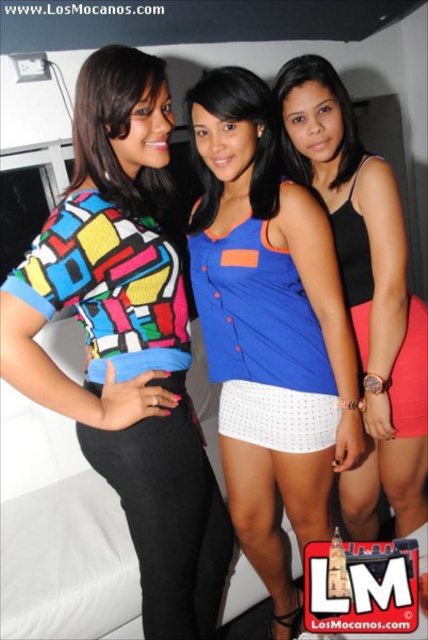
Consider the image. You are at a social gathering and want to take a photo of the two points mentioned. The points are labeled as point (366, 465) and point (103, 147). Which point should you focus on first to ensure both are in the frame?

You should focus on point (103, 147) first because it is in front of point (366, 465), so capturing it first ensures both points remain visible in the frame.

Consider the image. You are a photographer adjusting your camera settings to capture the three women in the scene. You notice two blue tops, the blue fabric top at center and the blue fabric blouse at center. Can you determine if there is enough space between them to focus on each individually?

The blue fabric top at center is 10.66 inches away from the blue fabric blouse at center. This distance should provide sufficient space to focus on each individually, as they are not too close together.

Looking at this image, you are a photographer trying to focus on the black matte tank top at center in the image. You notice a point marked at coordinate (365, 292). Based on the scene description, can you determine if this point is located on the black matte tank top at center?

The point at coordinate (365, 292) indicates the location of the black matte tank top at center, so yes, the point is located on the black matte tank top at center.